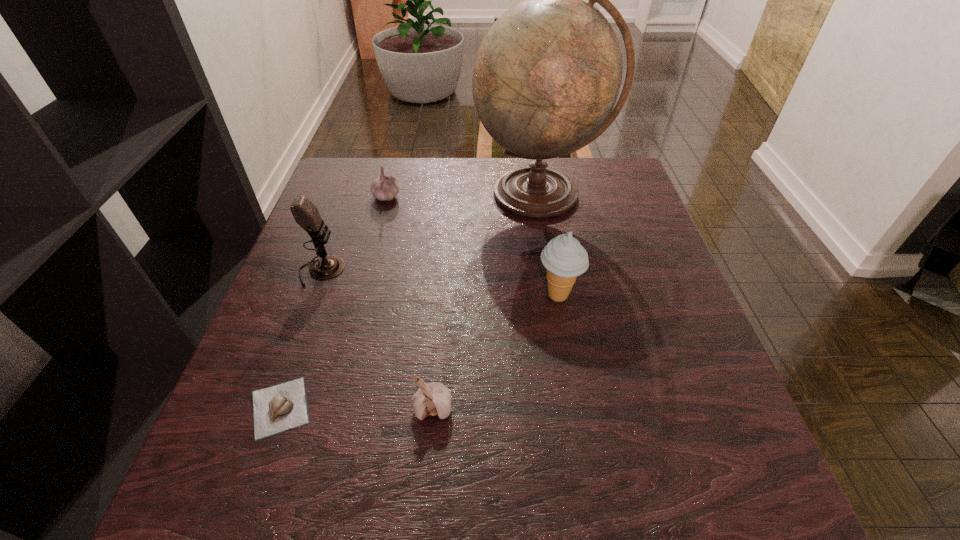
The image size is (960, 540). Find the location of `vacant point located between the rightmost garlic and the farthest garlic`. vacant point located between the rightmost garlic and the farthest garlic is located at coordinates (409, 302).

Image resolution: width=960 pixels, height=540 pixels. What are the coordinates of `vacant space that is in between the farthest garlic and the shortest garlic` in the screenshot? It's located at (333, 302).

This screenshot has height=540, width=960. What are the coordinates of `unoccupied area between the farthest garlic and the globe` in the screenshot? It's located at (463, 195).

The image size is (960, 540). In order to click on empty space between the farthest garlic and the icecream in this screenshot , I will do `click(472, 246)`.

Select which object is the fourth closest to the fourth object from left to right. Please provide its 2D coordinates. Your answer should be formatted as a tuple, i.e. [(x, y)], where the tuple contains the x and y coordinates of a point satisfying the conditions above.

[(547, 75)]

Where is `object identified as the second closest to the shortest object`? The image size is (960, 540). object identified as the second closest to the shortest object is located at coordinates (306, 214).

Where is `garlic that is the closest one to the shortest object`? garlic that is the closest one to the shortest object is located at coordinates (434, 398).

Find the location of `the closest garlic to the rightmost garlic`. the closest garlic to the rightmost garlic is located at coordinates (276, 409).

At what (x,y) coordinates should I click in order to perform the action: click on free space that satisfies the following two spatial constraints: 1. on the front-facing side of the rightmost garlic; 2. on the right side of the microphone. Please return your answer as a coordinate pair (x, y). The image size is (960, 540). Looking at the image, I should click on (271, 408).

Locate an element on the screen. This screenshot has width=960, height=540. vacant space that satisfies the following two spatial constraints: 1. on the front-facing side of the microphone; 2. on the left side of the icecream is located at coordinates (312, 295).